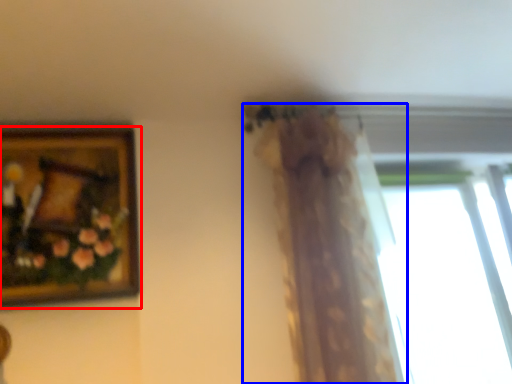
Question: Which object appears farthest to the camera in this image, picture frame (highlighted by a red box) or curtain (highlighted by a blue box)?

Choices:
 (A) picture frame
 (B) curtain

Answer: (A)